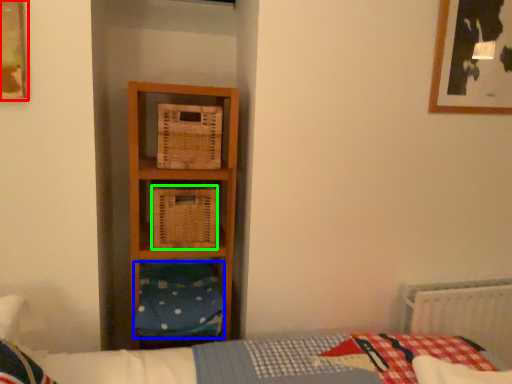
Question: Which object is positioned farthest from picture frame (highlighted by a red box)? Select from pillow (highlighted by a blue box) and crate (highlighted by a green box).

Choices:
 (A) pillow
 (B) crate

Answer: (A)